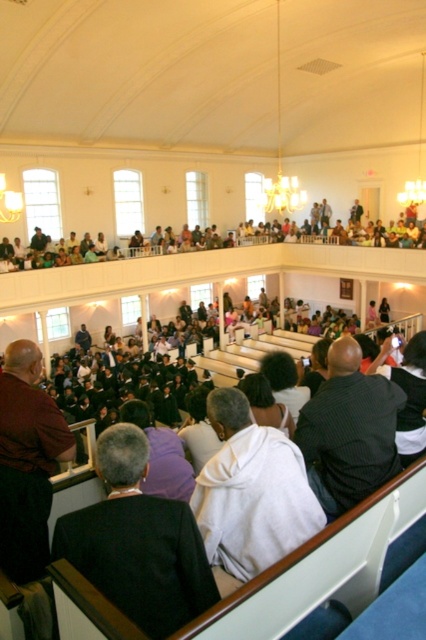
Who is taller, black fabric suit at lower left or white hoodie at center?

Standing taller between the two is white hoodie at center.

Which is above, black fabric suit at lower left or white hoodie at center?

white hoodie at center is higher up.

Find the location of a particular element. Image resolution: width=426 pixels, height=640 pixels. black fabric suit at lower left is located at coordinates (138, 541).

Find the location of a particular element. The height and width of the screenshot is (640, 426). black fabric suit at lower left is located at coordinates (138, 541).

Does white hoodie at center lie in front of dark striped shirt at center?

Yes, it is in front of dark striped shirt at center.

Between white hoodie at center and dark striped shirt at center, which one appears on the left side from the viewer's perspective?

From the viewer's perspective, white hoodie at center appears more on the left side.

Between point (210, 552) and point (394, 424), which one is positioned behind?

The point (394, 424) is behind.

The width and height of the screenshot is (426, 640). I want to click on white hoodie at center, so click(250, 493).

Who is higher up, black fabric suit at lower left or dark striped shirt at center?

dark striped shirt at center is higher up.

Does black fabric suit at lower left have a lesser width compared to dark striped shirt at center?

Yes, black fabric suit at lower left is thinner than dark striped shirt at center.

Which is behind, point (101, 442) or point (336, 344)?

Point (336, 344)

Find the location of a particular element. black fabric suit at lower left is located at coordinates (138, 541).